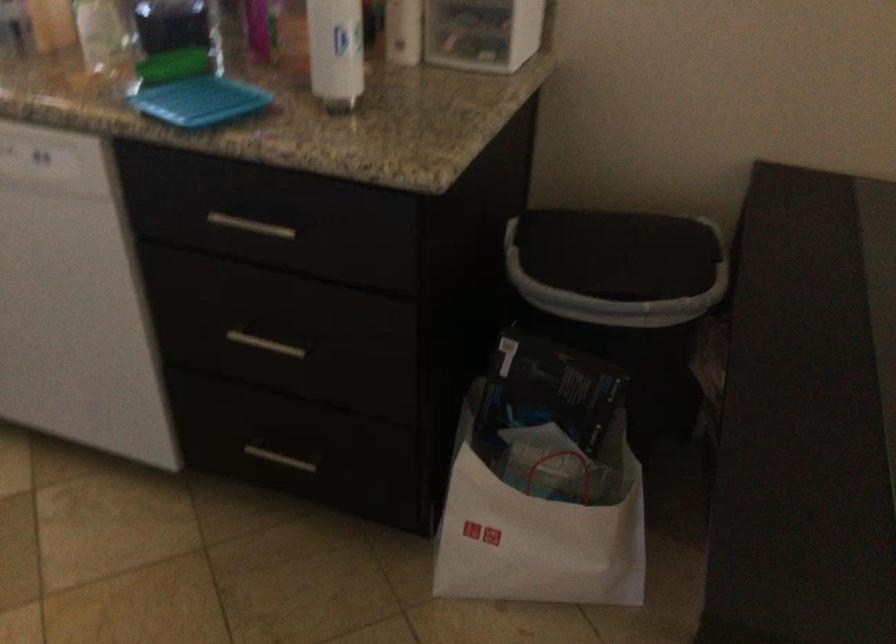
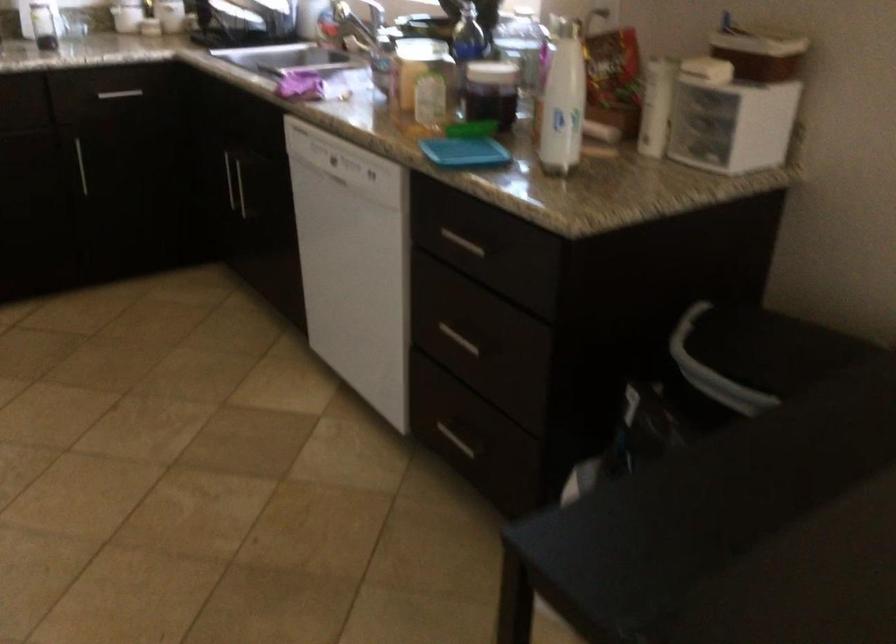
In the second image, find the point that corresponds to [268,457] in the first image.

(455, 440)